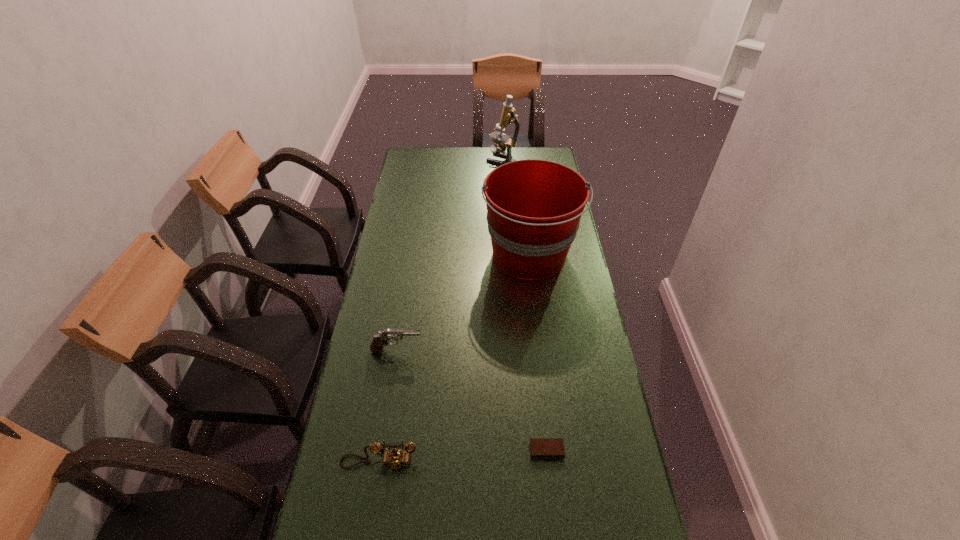
Image resolution: width=960 pixels, height=540 pixels. I want to click on the farthest object, so click(x=508, y=116).

Where is `the second farthest object`? The height and width of the screenshot is (540, 960). the second farthest object is located at coordinates pyautogui.click(x=534, y=207).

Find the location of a particular element. The height and width of the screenshot is (540, 960). pistol is located at coordinates (379, 340).

Identify the location of telephone. This screenshot has height=540, width=960. (394, 459).

At what (x,y) coordinates should I click in order to perform the action: click on the shortest object. Please return your answer as a coordinate pair (x, y). The image size is (960, 540). Looking at the image, I should click on (541, 448).

I want to click on free spot located on the front of the farthest object, so click(x=504, y=191).

At what (x,y) coordinates should I click in order to perform the action: click on free space located 0.340m on the front of the bucket. Please return your answer as a coordinate pair (x, y). This screenshot has height=540, width=960. Looking at the image, I should click on (543, 375).

I want to click on vacant point located at the barrel of the third nearest object, so click(536, 351).

Where is `vacant space located on the front-facing side of the telephone`? This screenshot has height=540, width=960. vacant space located on the front-facing side of the telephone is located at coordinates (369, 528).

Locate an element on the screen. This screenshot has height=540, width=960. free region located on the front face of the alarm clock is located at coordinates (555, 523).